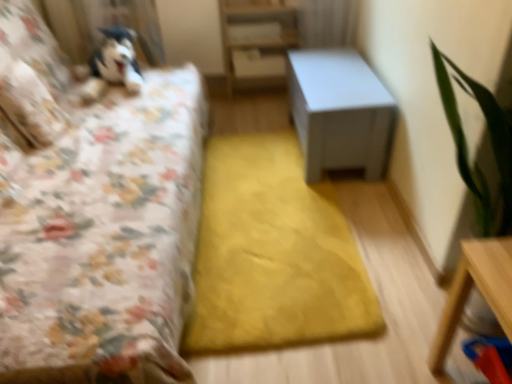
This screenshot has height=384, width=512. I want to click on wooden table at lower right, the second table from the back, so click(480, 291).

The width and height of the screenshot is (512, 384). I want to click on white matte table at center, positioned as the first table in top-to-bottom order, so click(340, 112).

The image size is (512, 384). What are the coordinates of `floral fabric pillow at left, which ranks as the second pillow in back-to-front order` in the screenshot? It's located at tap(31, 105).

What is the approximate width of floral fabric bed at left?

It is 1.13 meters.

What are the coordinates of `white matte drawer at center` in the screenshot? It's located at (257, 64).

Does wooden table at lower right, the second table from the back, turn towards floral fabric pillow at left, the 2th pillow from the left?

No.

Considering the sizes of objects wooden table at lower right, positioned as the second table in top-to-bottom order, and floral fabric pillow at left, arranged as the first pillow when ordered from the bottom, in the image provided, who is thinner, wooden table at lower right, positioned as the second table in top-to-bottom order, or floral fabric pillow at left, arranged as the first pillow when ordered from the bottom,?

Thinner between the two is floral fabric pillow at left, arranged as the first pillow when ordered from the bottom.

Considering the points (480, 249) and (47, 88), which point is behind, point (480, 249) or point (47, 88)?

The point (47, 88) is more distant.

Where is `pillow that is the 1st object above the wooden table at lower right, positioned as the second table in top-to-bottom order (from a real-world perspective)`? The height and width of the screenshot is (384, 512). pillow that is the 1st object above the wooden table at lower right, positioned as the second table in top-to-bottom order (from a real-world perspective) is located at coordinates (31, 105).

Between white matte drawer at center and fluffy white pillow at upper left, placed as the first pillow when sorted from top to bottom, which one has less height?

white matte drawer at center.

Is fluffy white pillow at upper left, placed as the first pillow when sorted from top to bottom, at the back of white matte drawer at center?

No, white matte drawer at center is not facing the opposite direction of fluffy white pillow at upper left, placed as the first pillow when sorted from top to bottom.

Identify the location of drawer on the right side of fluffy white pillow at upper left, the 2th pillow when ordered from bottom to top. The width and height of the screenshot is (512, 384). (257, 64).

Who is taller, floral fabric pillow at left, the 2th pillow from the left, or floral fabric bed at left?

With more height is floral fabric bed at left.

Could you tell me if floral fabric pillow at left, which ranks as the second pillow in back-to-front order, is turned towards floral fabric bed at left?

Yes, floral fabric pillow at left, which ranks as the second pillow in back-to-front order, faces towards floral fabric bed at left.

The width and height of the screenshot is (512, 384). I want to click on the 1st pillow counting from the left side of the floral fabric bed at left, so click(x=31, y=105).

Between floral fabric pillow at left, which is counted as the 2th pillow, starting from the top, and floral fabric bed at left, which one has larger size?

floral fabric bed at left is bigger.

Is white matte bookshelf at center smaller than white matte drawer at center?

No.

From the image's perspective, who appears lower, white matte bookshelf at center or white matte drawer at center?

From the image's view, white matte drawer at center is below.

Is white matte bookshelf at center far away from white matte drawer at center?

No.

Based on their positions, is white matte bookshelf at center located to the left or right of white matte drawer at center?

white matte bookshelf at center is positioned on white matte drawer at center's right side.

From the image's perspective, which one is positioned higher, white matte table at center, the second table ordered from the bottom, or floral fabric bed at left?

white matte table at center, the second table ordered from the bottom.

Can you tell me how much white matte table at center, the 2th table from the front, and floral fabric bed at left differ in facing direction?

The angular difference between white matte table at center, the 2th table from the front, and floral fabric bed at left is 179 degrees.

Consider the image. Between white matte table at center, positioned as the first table in top-to-bottom order, and floral fabric bed at left, which one has smaller size?

white matte table at center, positioned as the first table in top-to-bottom order.

Which object is closer to the camera, white matte table at center, placed as the first table when sorted from back to front, or floral fabric bed at left?

Positioned in front is floral fabric bed at left.

From the image's perspective, who appears lower, white matte drawer at center or floral fabric bed at left?

floral fabric bed at left.

Is white matte drawer at center far from floral fabric bed at left?

Yes.

Would you say white matte drawer at center is part of floral fabric pillow at left, positioned as the 1th pillow in front-to-back order,'s contents?

No, white matte drawer at center is located outside of floral fabric pillow at left, positioned as the 1th pillow in front-to-back order.

Does floral fabric pillow at left, arranged as the first pillow when ordered from the bottom, have a lesser height compared to white matte drawer at center?

In fact, floral fabric pillow at left, arranged as the first pillow when ordered from the bottom, may be taller than white matte drawer at center.

Based on the photo, which of these two, floral fabric pillow at left, the first pillow in the right-to-left sequence, or white matte drawer at center, is bigger?

floral fabric pillow at left, the first pillow in the right-to-left sequence, is bigger.

Image resolution: width=512 pixels, height=384 pixels. I want to click on table in front of the floral fabric pillow at left, arranged as the first pillow when ordered from the bottom, so click(x=480, y=291).

Locate an element on the screen. The height and width of the screenshot is (384, 512). the 2nd pillow to the left when counting from the white matte drawer at center is located at coordinates (32, 45).

Considering their positions, is fluffy white pillow at upper left, the 1th pillow from the back, positioned closer to white matte bookshelf at center than white matte drawer at center?

white matte drawer at center is positioned closer to the anchor white matte bookshelf at center.

Which object lies further to the anchor point white matte table at center, placed as the first table when sorted from back to front, white matte bookshelf at center or floral fabric bed at left?

floral fabric bed at left is positioned further to the anchor white matte table at center, placed as the first table when sorted from back to front.

Estimate the real-world distances between objects in this image. Which object is further from fluffy white pillow at upper left, the 1th pillow in the left-to-right sequence, white matte drawer at center or white matte bookshelf at center?

white matte drawer at center.

When comparing their distances from wooden table at lower right, acting as the 1th table starting from the front, does white matte bookshelf at center or fluffy white pillow at upper left, the 2th pillow when ordered from bottom to top, seem further?

white matte bookshelf at center is further to wooden table at lower right, acting as the 1th table starting from the front.

When comparing their distances from floral fabric bed at left, does fluffy white pillow at upper left, which is the second pillow in right-to-left order, or floral fabric pillow at left, the 2th pillow from the left, seem closer?

floral fabric pillow at left, the 2th pillow from the left, is closer to floral fabric bed at left.

Considering their positions, is white matte drawer at center positioned further to floral fabric pillow at left, positioned as the 1th pillow in front-to-back order, than white matte bookshelf at center?

The object further to floral fabric pillow at left, positioned as the 1th pillow in front-to-back order, is white matte drawer at center.

Estimate the real-world distances between objects in this image. Which object is further from white matte drawer at center, floral fabric pillow at left, which ranks as the second pillow in back-to-front order, or white matte table at center, placed as the first table when sorted from back to front?

floral fabric pillow at left, which ranks as the second pillow in back-to-front order, is positioned further to the anchor white matte drawer at center.

When comparing their distances from floral fabric pillow at left, the 2th pillow from the left, does wooden table at lower right, the second table from the back, or white matte bookshelf at center seem closer?

white matte bookshelf at center lies closer to floral fabric pillow at left, the 2th pillow from the left, than the other object.

Where is `pillow between fluffy white pillow at upper left, the 2th pillow when ordered from bottom to top, and white matte drawer at center`? The width and height of the screenshot is (512, 384). pillow between fluffy white pillow at upper left, the 2th pillow when ordered from bottom to top, and white matte drawer at center is located at coordinates (31, 105).

Find the location of a particular element. The image size is (512, 384). pillow between fluffy white pillow at upper left, the 1th pillow from the back, and wooden table at lower right, acting as the 1th table starting from the front, in the horizontal direction is located at coordinates (31, 105).

At what (x,y) coordinates should I click in order to perform the action: click on table between wooden table at lower right, the second table from the back, and white matte bookshelf at center in the front-back direction. Please return your answer as a coordinate pair (x, y). Looking at the image, I should click on (340, 112).

What are the coordinates of `bookshelf between floral fabric pillow at left, which is counted as the 2th pillow, starting from the top, and white matte drawer at center from front to back` in the screenshot? It's located at (257, 41).